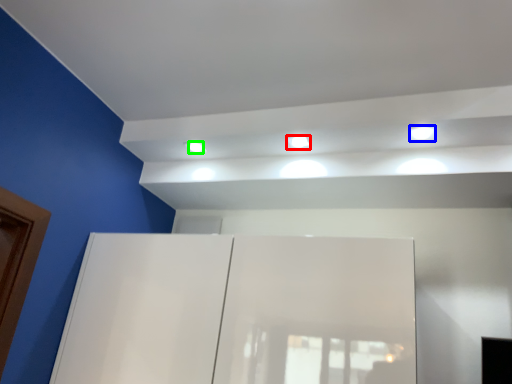
Question: Which object is the closest to the light (highlighted by a red box)? Choose among these: light (highlighted by a blue box) or dot (highlighted by a green box).

Choices:
 (A) light
 (B) dot

Answer: (B)